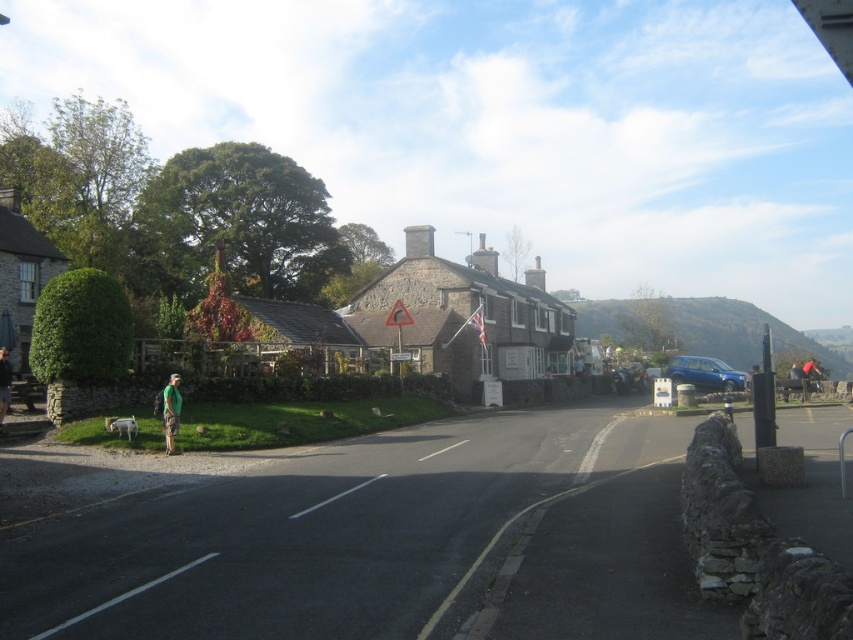
Is stone house at center positioned behind green fabric shirt at lower left?

Yes, it is.

Between point (421, 358) and point (6, 348), which one is positioned in front?

Positioned in front is point (6, 348).

This screenshot has width=853, height=640. In order to click on stone house at center in this screenshot , I will do `click(466, 316)`.

Is point (419, 291) positioned behind point (172, 384)?

That is True.

Does point (456, 291) lie in front of point (169, 429)?

No, it is behind (169, 429).

The image size is (853, 640). In order to click on stone house at center in this screenshot , I will do `click(466, 316)`.

The width and height of the screenshot is (853, 640). What do you see at coordinates (171, 412) in the screenshot? I see `green fabric backpack at lower left` at bounding box center [171, 412].

Who is more forward, (164, 428) or (4, 397)?

Point (4, 397)

The image size is (853, 640). I want to click on green fabric backpack at lower left, so click(171, 412).